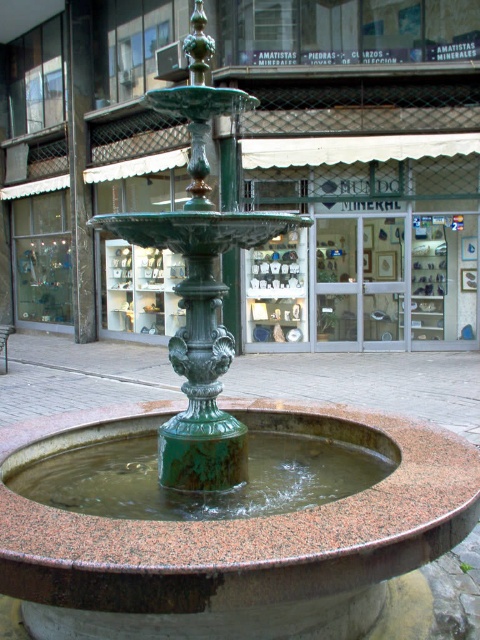
Is green glazed fountain at center to the right of green patina fountain at center from the viewer's perspective?

Indeed, green glazed fountain at center is positioned on the right side of green patina fountain at center.

Does green glazed fountain at center have a greater width compared to green patina fountain at center?

Indeed, green glazed fountain at center has a greater width compared to green patina fountain at center.

Where is `green glazed fountain at center`? green glazed fountain at center is located at coordinates (248, 547).